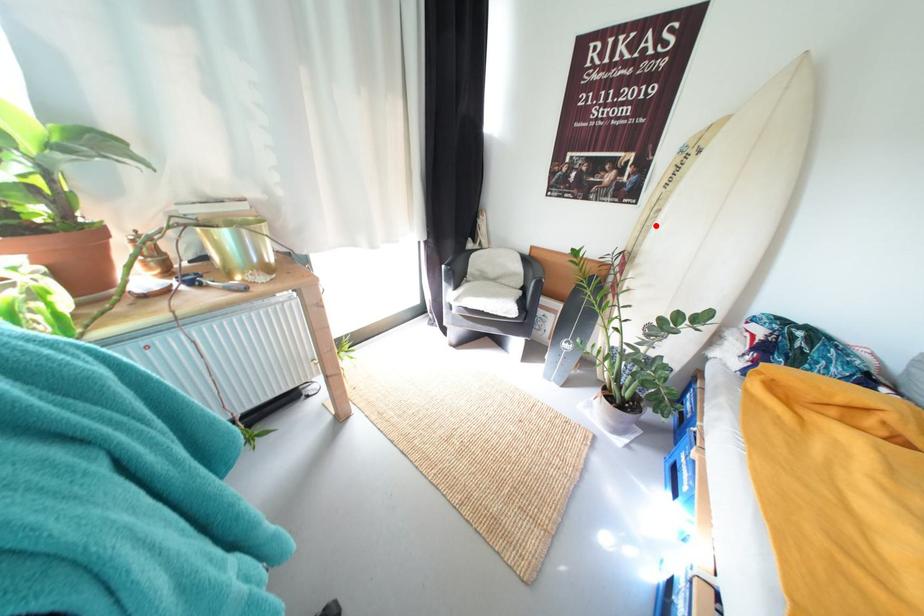
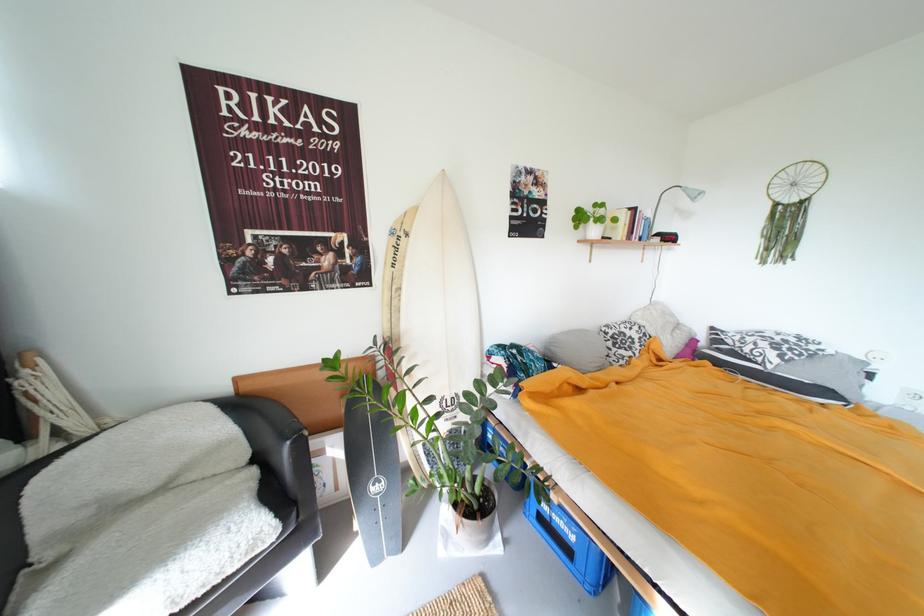
Where in the second image is the point corresponding to the highlighted location from the first image?

(402, 306)